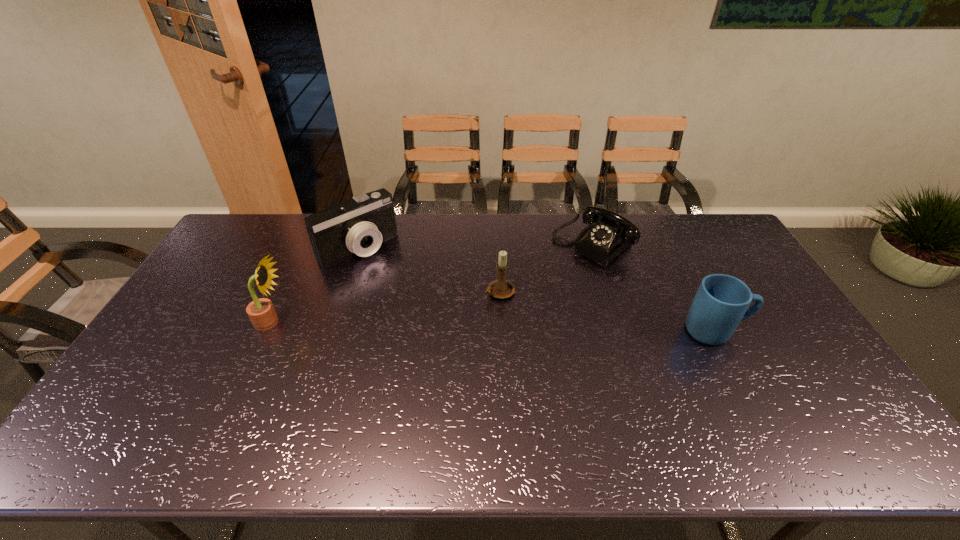
The image size is (960, 540). I want to click on vacant spot on the desktop that is between the leftmost object and the rightmost object and is positioned on the dial of the telephone, so pyautogui.click(x=494, y=327).

Identify the location of free space on the desktop that is between the tallest object and the mug and is positioned on the side of the third object from right to left with the handle. (434, 325).

Identify the location of vacant spot on the desktop that is between the leftmost object and the mug and is positioned on the lens of the second object from left to right. Image resolution: width=960 pixels, height=540 pixels. (437, 325).